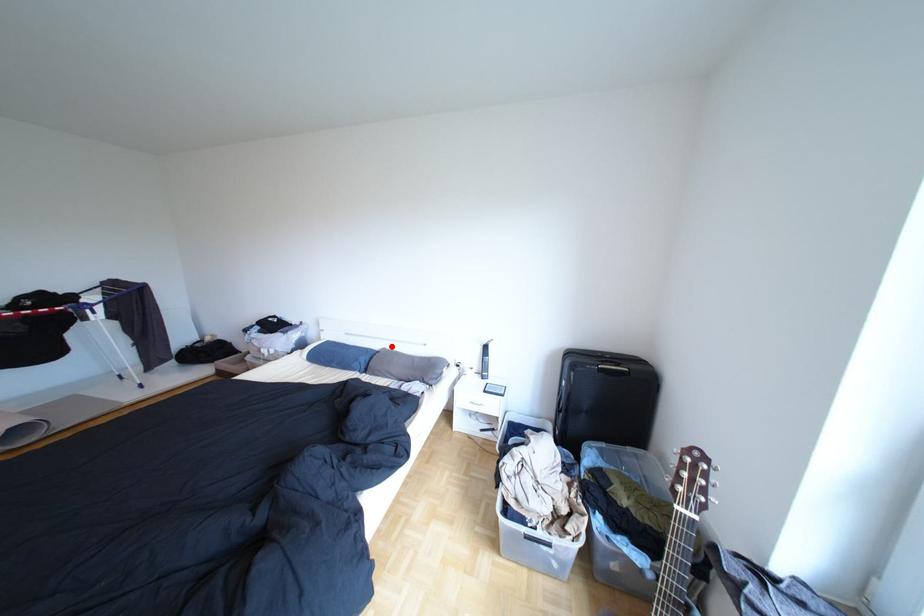
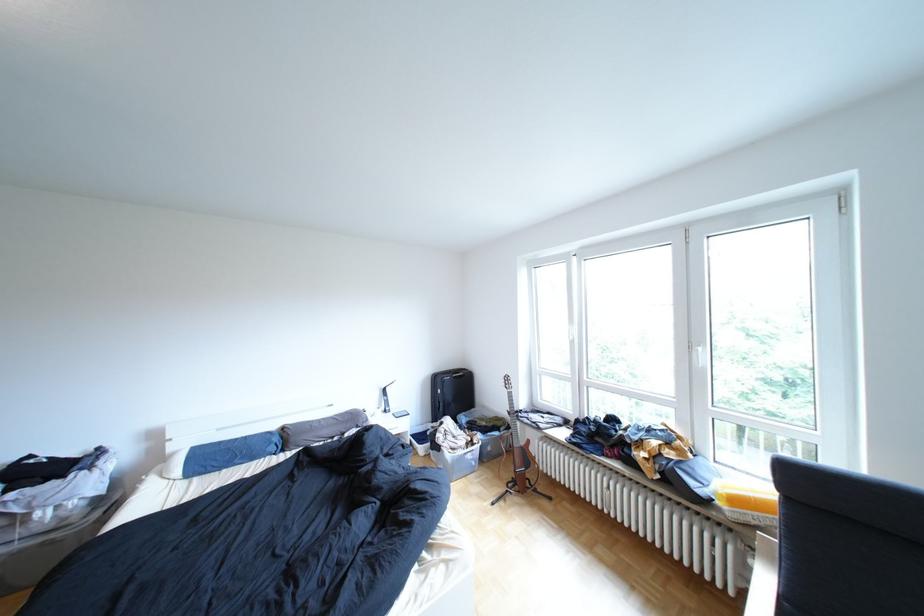
Question: I am providing you with two images of the same scene from different viewpoints. A red point is marked on the first image. At the location where the point appears in image 1, is it still visible in image 2?

Choices:
 (A) Yes
 (B) No

Answer: (A)